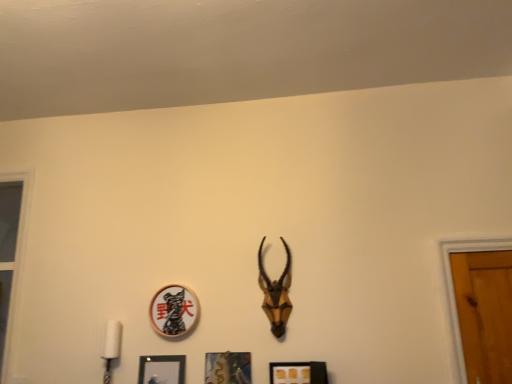
Question: From the image's perspective, is matte gold picture frame at lower center, the first picture frame in the right-to-left sequence, positioned above or below wooden circle at center, arranged as the second picture frame when viewed from the left?

Choices:
 (A) above
 (B) below

Answer: (B)

Question: Is matte gold picture frame at lower center, which appears as the 4th picture frame when viewed from the left, taller or shorter than wooden circle at center, arranged as the second picture frame when viewed from the left?

Choices:
 (A) short
 (B) tall

Answer: (A)

Question: Which is nearer to the wooden circle at center, arranged as the second picture frame when viewed from the left?

Choices:
 (A) metallic silver picture frame at center, the third picture frame in the left-to-right sequence
 (B) black matte picture frame at lower center, marked as the 4th picture frame in a right-to-left arrangement
 (C) brown matte antelope head at center
 (D) matte gold picture frame at lower center, which appears as the 4th picture frame when viewed from the left

Answer: (B)

Question: Which object is positioned closest to the black matte picture frame at lower center, marked as the 4th picture frame in a right-to-left arrangement?

Choices:
 (A) metallic silver picture frame at center, the third picture frame in the left-to-right sequence
 (B) wooden circle at center, acting as the 3th picture frame starting from the right
 (C) brown matte antelope head at center
 (D) matte gold picture frame at lower center, which appears as the 4th picture frame when viewed from the left

Answer: (B)